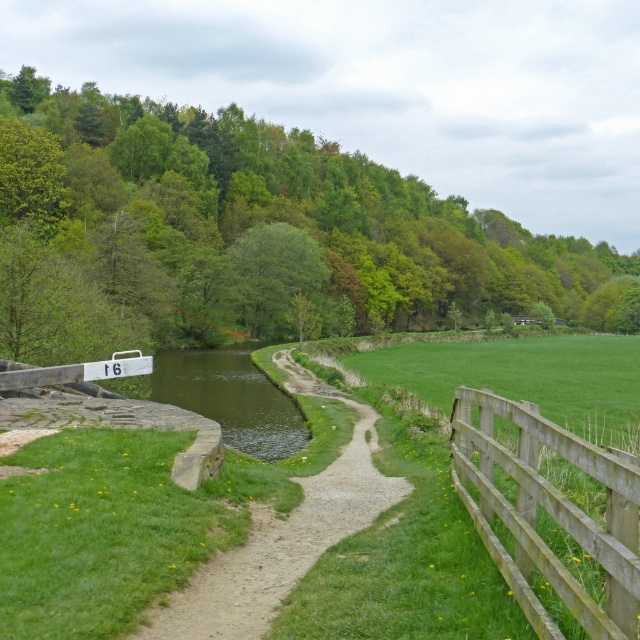
You are a hiker walking along the dirt path next to the canal and want to know which object, the green leafy tree at upper center or the wooden fence at right, is wider. Can you tell me?

The green leafy tree at upper center is wider than the wooden fence at right because its width surpasses the wooden fence at right.